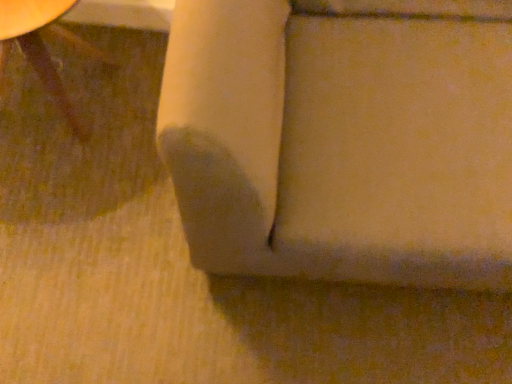
This screenshot has width=512, height=384. Find the location of `vacant space in between matte beige cushion at center, positioned as the first furniture in right-to-left order, and matte brown wood table at lower left, placed as the second furniture when sorted from right to left`. vacant space in between matte beige cushion at center, positioned as the first furniture in right-to-left order, and matte brown wood table at lower left, placed as the second furniture when sorted from right to left is located at coordinates (119, 167).